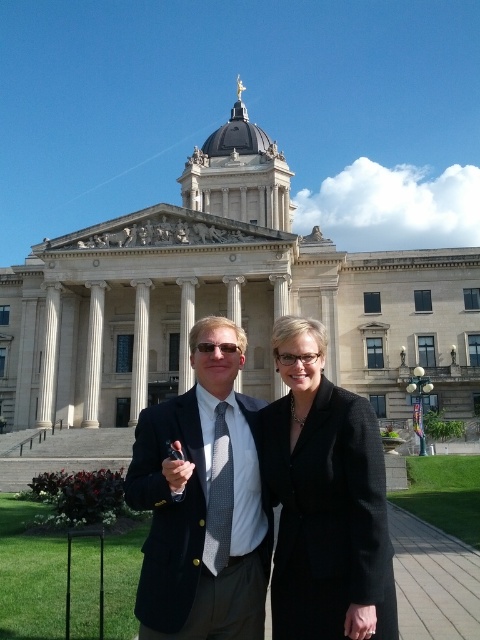
Locate an element on the screen. The width and height of the screenshot is (480, 640). black wool coat at center is located at coordinates (324, 499).

Can you confirm if black wool coat at center is thinner than white marble pillar at center?

Incorrect, black wool coat at center's width is not less than white marble pillar at center's.

Is point (355, 589) behind point (143, 360)?

No.

You are a GUI agent. You are given a task and a screenshot of the screen. Output one action in this format:
    pyautogui.click(x=<x>, y=<y>)
    Task: Click on the black wool coat at center
    
    Given the screenshot: What is the action you would take?
    pyautogui.click(x=324, y=499)

Does point (254, 609) lie behind point (101, 300)?

No, it is in front of (101, 300).

Does matte black blazer at center appear under white marble column at center?

Yes, matte black blazer at center is below white marble column at center.

Is point (141, 593) positioned behind point (87, 397)?

That is False.

Find the location of `matte black blazer at center`. matte black blazer at center is located at coordinates (202, 500).

Who is positioned more to the right, black wool coat at center or white marble column at center?

black wool coat at center is more to the right.

Can you confirm if black wool coat at center is smaller than white marble column at center?

Incorrect, black wool coat at center is not smaller in size than white marble column at center.

The image size is (480, 640). Find the location of `black wool coat at center`. black wool coat at center is located at coordinates (324, 499).